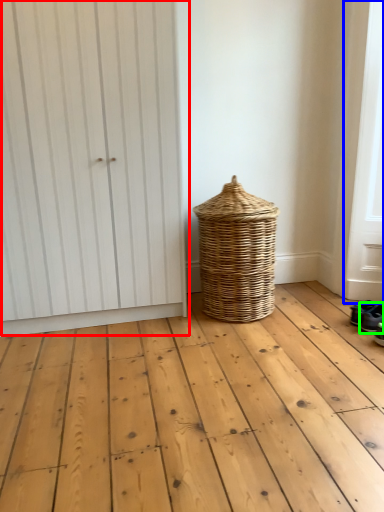
Question: Considering the real-world distances, which object is farthest from door (highlighted by a red box)? screen door (highlighted by a blue box) or footwear (highlighted by a green box)?

Choices:
 (A) screen door
 (B) footwear

Answer: (B)